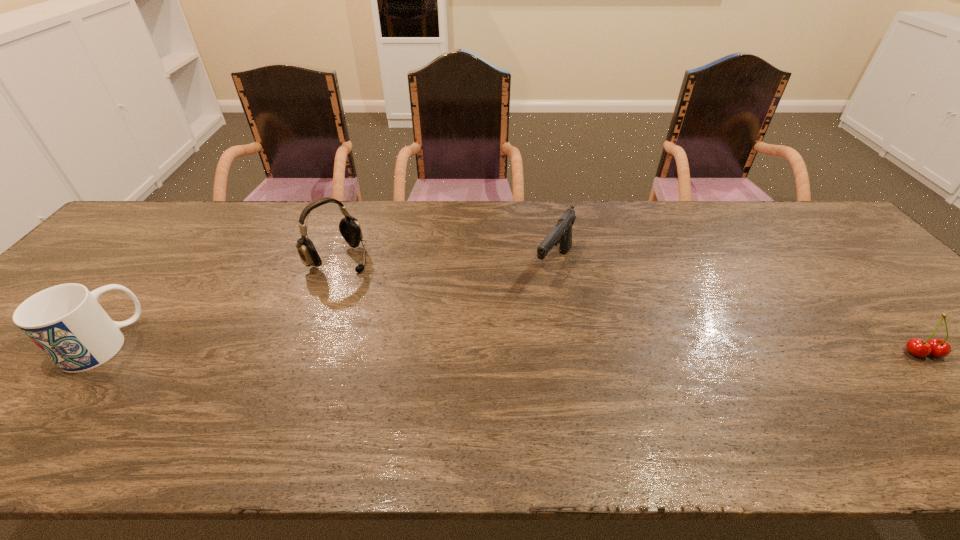
Where is `unoccupied area between the leftmost object and the second object from left to right`? Image resolution: width=960 pixels, height=540 pixels. unoccupied area between the leftmost object and the second object from left to right is located at coordinates (220, 301).

You are a GUI agent. You are given a task and a screenshot of the screen. Output one action in this format:
    pyautogui.click(x=<x>, y=<y>)
    Task: Click on the vacant region between the leftmost object and the shortest object
    
    Given the screenshot: What is the action you would take?
    pyautogui.click(x=513, y=348)

Choose which object is the third nearest neighbor to the mug. Please provide its 2D coordinates. Your answer should be formatted as a tuple, i.e. [(x, y)], where the tuple contains the x and y coordinates of a point satisfying the conditions above.

[(939, 348)]

You are a GUI agent. You are given a task and a screenshot of the screen. Output one action in this format:
    pyautogui.click(x=<x>, y=<y>)
    Task: Click on the object that is the second closest one to the tallest object
    This screenshot has height=540, width=960.
    Given the screenshot: What is the action you would take?
    pyautogui.click(x=561, y=234)

The width and height of the screenshot is (960, 540). Find the location of `free spot that satisfies the following two spatial constraints: 1. on the back side of the leftmost object; 2. on the right side of the third object from left to right`. free spot that satisfies the following two spatial constraints: 1. on the back side of the leftmost object; 2. on the right side of the third object from left to right is located at coordinates (166, 266).